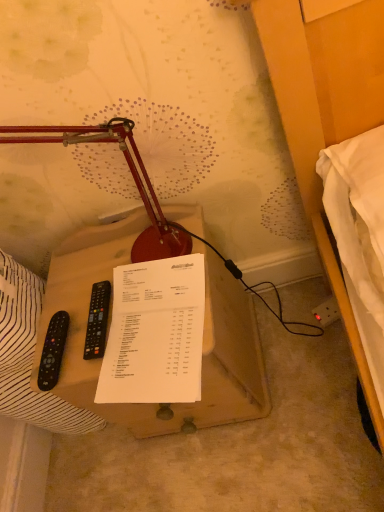
The width and height of the screenshot is (384, 512). What are the coordinates of `vacant area that is in front of black plastic remote control at left, acting as the 2th remote control starting from the left` in the screenshot? It's located at tap(132, 358).